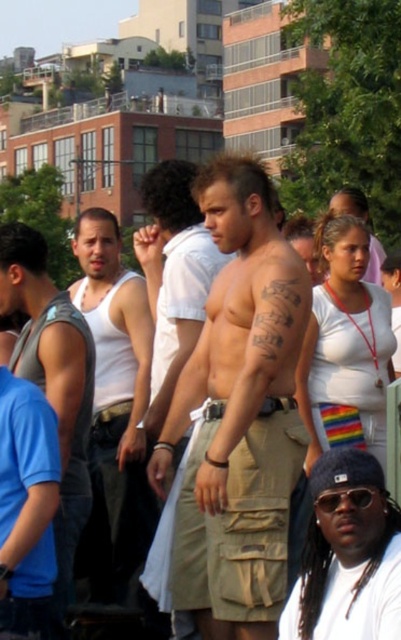
Question: Observing the image, what is the correct spatial positioning of white matte tank top at center in reference to gray sleeveless shirt at left?

Choices:
 (A) below
 (B) above

Answer: (B)

Question: Which of the following is the farthest from the observer?

Choices:
 (A) gray sleeveless shirt at left
 (B) khaki cargo shorts at center

Answer: (B)

Question: Can you confirm if khaki cargo shorts at center is thinner than tan cargo shorts at center?

Choices:
 (A) no
 (B) yes

Answer: (A)

Question: Which is farther from the white matte tank top at center?

Choices:
 (A) tan cargo shorts at center
 (B) black knit cap at lower right

Answer: (B)

Question: Which point is closer to the camera?

Choices:
 (A) white matte tank top at center
 (B) black knit cap at lower right
 (C) gray sleeveless shirt at left

Answer: (B)

Question: Does white matte tank top at center come in front of tan cargo shorts at center?

Choices:
 (A) no
 (B) yes

Answer: (A)